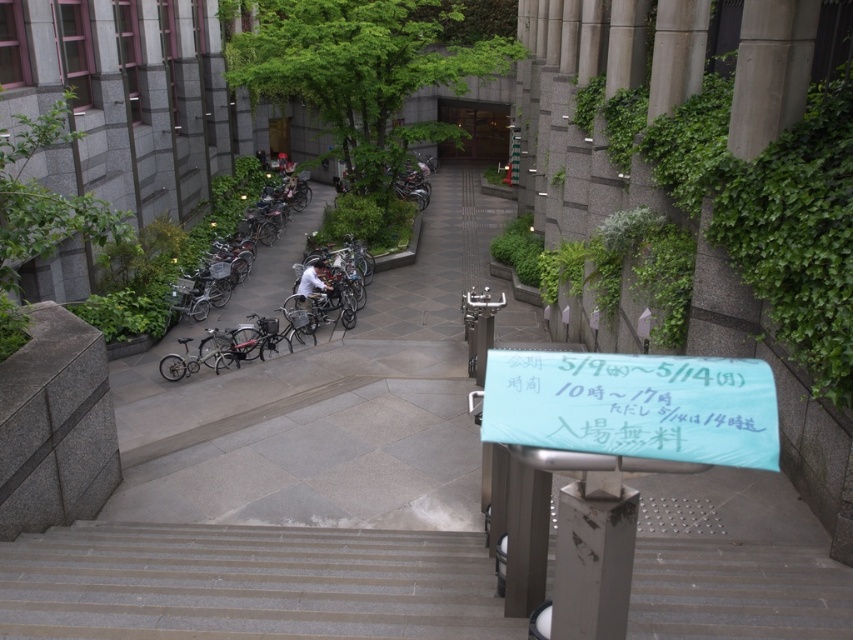
Between point (425, 595) and point (656, 452), which one is positioned in front?

Point (656, 452) is more forward.

The height and width of the screenshot is (640, 853). What do you see at coordinates (248, 582) in the screenshot?
I see `gray concrete stairs at lower center` at bounding box center [248, 582].

Find the location of a particular element. The image size is (853, 640). gray concrete stairs at lower center is located at coordinates [x=248, y=582].

Measure the distance from gray concrete stairs at lower center to matte black bicycle at center.

The distance of gray concrete stairs at lower center from matte black bicycle at center is 10.07 meters.

Looking at this image, does gray concrete stairs at lower center have a larger size compared to matte black bicycle at center?

No, gray concrete stairs at lower center is not bigger than matte black bicycle at center.

Locate an element on the screen. The height and width of the screenshot is (640, 853). gray concrete stairs at lower center is located at coordinates (248, 582).

Between gray concrete pavement at center and gray concrete stairs at lower center, which one is positioned lower?

gray concrete stairs at lower center

Between gray concrete pavement at center and gray concrete stairs at lower center, which one is positioned higher?

Positioned higher is gray concrete pavement at center.

What do you see at coordinates (293, 483) in the screenshot? I see `gray concrete pavement at center` at bounding box center [293, 483].

What are the coordinates of `gray concrete pavement at center` in the screenshot? It's located at (293, 483).